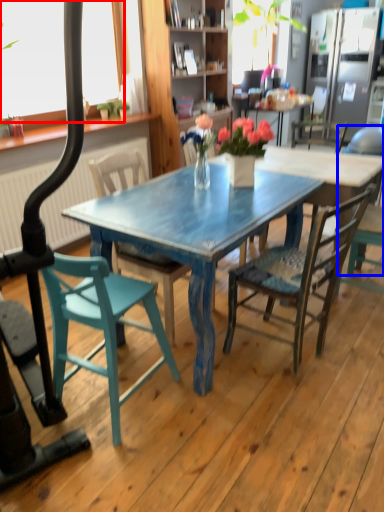
Question: Among these objects, which one is farthest to the camera, window screen (highlighted by a red box) or chair (highlighted by a blue box)?

Choices:
 (A) window screen
 (B) chair

Answer: (A)